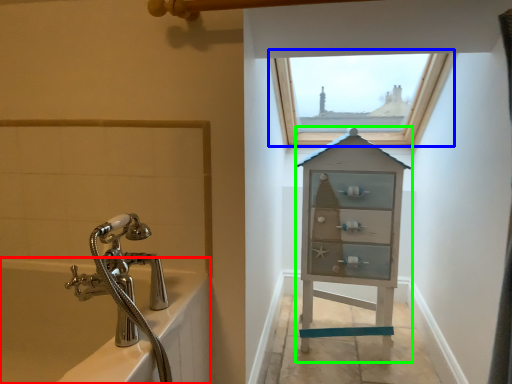
Question: Estimate the real-world distances between objects in this image. Which object is farther from bath (highlighted by a red box), window (highlighted by a blue box) or medicine cabinet (highlighted by a green box)?

Choices:
 (A) window
 (B) medicine cabinet

Answer: (A)